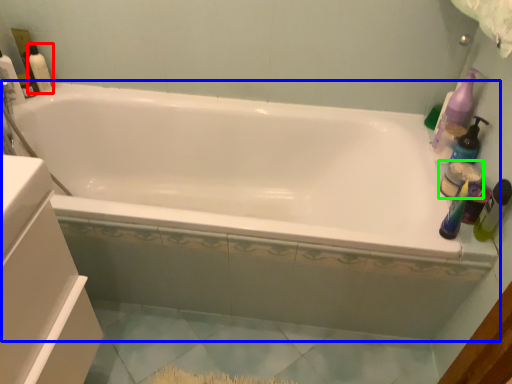
Question: Estimate the real-world distances between objects in this image. Which object is farther from cleaning product (highlighted by a red box), bathtub (highlighted by a blue box) or toiletry (highlighted by a green box)?

Choices:
 (A) bathtub
 (B) toiletry

Answer: (B)